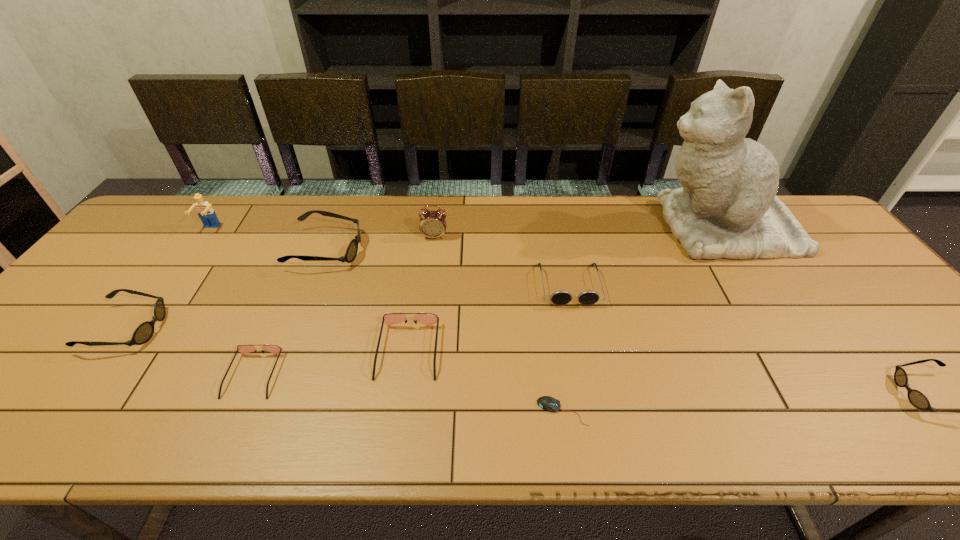
Where is `free space located on the lenses of the second nearest black sunglasses`? The height and width of the screenshot is (540, 960). free space located on the lenses of the second nearest black sunglasses is located at coordinates (243, 328).

You are a GUI agent. You are given a task and a screenshot of the screen. Output one action in this format:
    pyautogui.click(x=<x>, y=<y>)
    Task: Click on the vacant area situated 0.130m on the bridge of the third sunglasses from right to left
    
    Given the screenshot: What is the action you would take?
    pyautogui.click(x=396, y=437)

I want to click on free space located on the bridge of the left pink sunglasses, so click(231, 426).

Where is `free space located on the left of the shortest object`? This screenshot has height=540, width=960. free space located on the left of the shortest object is located at coordinates (500, 411).

At what (x,y) coordinates should I click in order to perform the action: click on cat that is at the far edge. Please return your answer as a coordinate pair (x, y). Looking at the image, I should click on (727, 207).

Where is `Lego that is at the far edge`? Lego that is at the far edge is located at coordinates (206, 213).

Where is `alarm clock located in the far edge section of the desktop`? This screenshot has width=960, height=540. alarm clock located in the far edge section of the desktop is located at coordinates (432, 224).

This screenshot has height=540, width=960. In order to click on sunglasses situated at the far edge in this screenshot , I will do `click(352, 249)`.

Where is `object present at the near edge`? The image size is (960, 540). object present at the near edge is located at coordinates (548, 403).

The width and height of the screenshot is (960, 540). What are the coordinates of `object that is positioned at the left edge` in the screenshot? It's located at (144, 332).